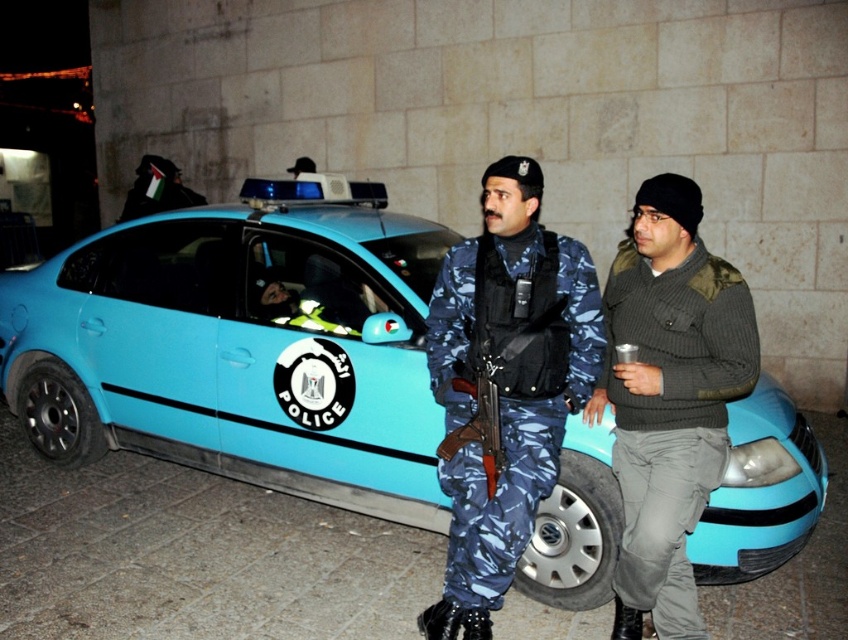
You are standing in front of the police car and need to locate two specific points marked on the car. The first point is at coordinates point (x=369, y=333) and the second is at point (x=633, y=444). Which of these points is closer to your current position?

Point (x=369, y=333) is closer to your current position because it is further to the viewer than point (x=633, y=444), meaning it is physically nearer to you.

You are a toy collector who wants to display the light blue plastic car at center and the camouflage uniform at center on a shelf. The shelf has a height limit of 12 inches. Can both items fit vertically on the shelf without exceeding the height limit?

The light blue plastic car at center is taller than the camouflage uniform at center. Since the car is taller, but the exact height isn